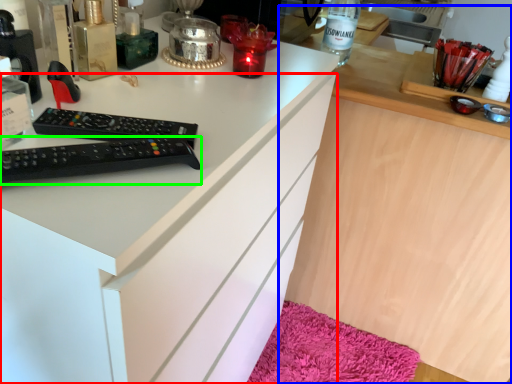
Question: Which is nearer to the cabinetry (highlighted by a red box)? computer (highlighted by a blue box) or remote control (highlighted by a green box).

Choices:
 (A) computer
 (B) remote control

Answer: (B)